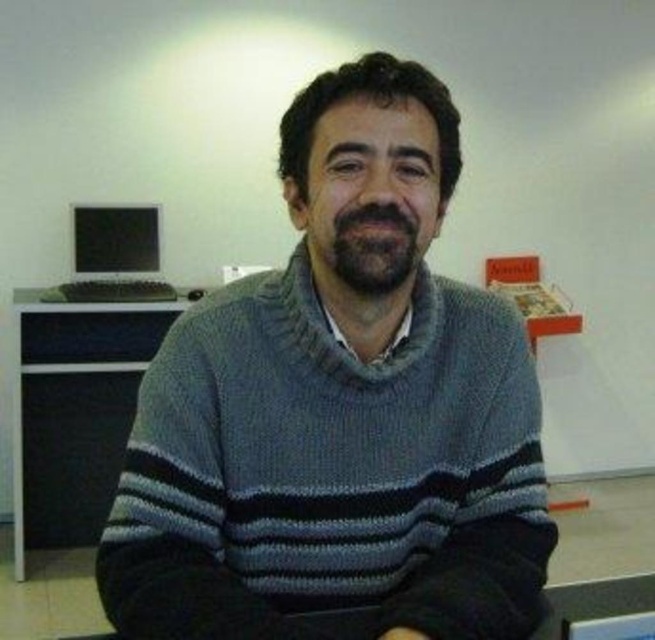
Does gray knitted sweater at center have a larger size compared to matte black monitor at left?

Yes.

Find the location of a particular element. The width and height of the screenshot is (655, 640). gray knitted sweater at center is located at coordinates (339, 412).

I want to click on gray knitted sweater at center, so click(339, 412).

Is gray knitted sweater at center thinner than black plastic table at left?

Correct, gray knitted sweater at center's width is less than black plastic table at left's.

Between gray knitted sweater at center and black plastic table at left, which one is positioned lower?

black plastic table at left is lower down.

The image size is (655, 640). I want to click on gray knitted sweater at center, so click(x=339, y=412).

Is black plastic table at left positioned behind matte black monitor at left?

No.

In the scene shown: Who is more forward, (86, 339) or (126, 216)?

Point (86, 339) is in front.

You are a GUI agent. You are given a task and a screenshot of the screen. Output one action in this format:
    pyautogui.click(x=<x>, y=<y>)
    Task: Click on the black plastic table at left
    
    Given the screenshot: What is the action you would take?
    pyautogui.click(x=75, y=410)